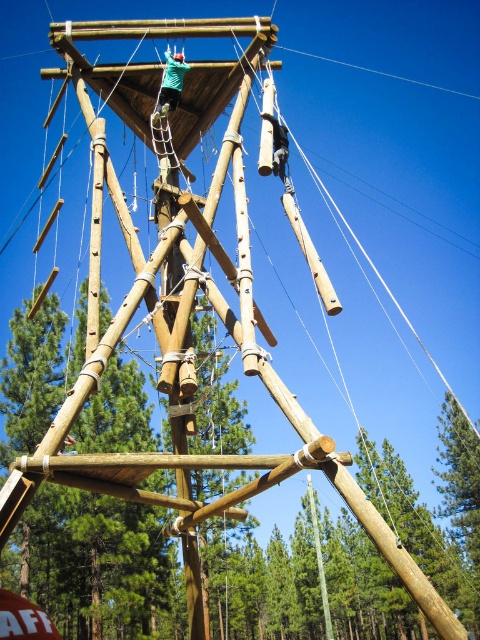
Locate an element on the screen. This screenshot has height=640, width=480. natural wood pole at center is located at coordinates (91, 563).

Is natural wood pole at center taller than smooth bamboo pole at center?

Correct, natural wood pole at center is much taller as smooth bamboo pole at center.

This screenshot has width=480, height=640. Find the location of `natural wood pole at center`. natural wood pole at center is located at coordinates (91, 563).